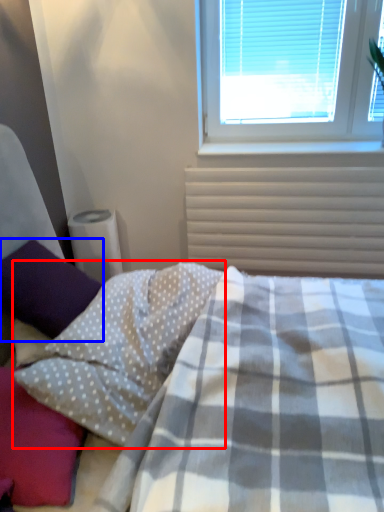
Question: Which of the following is the closest to the observer, pillow (highlighted by a red box) or pillow (highlighted by a blue box)?

Choices:
 (A) pillow
 (B) pillow

Answer: (A)